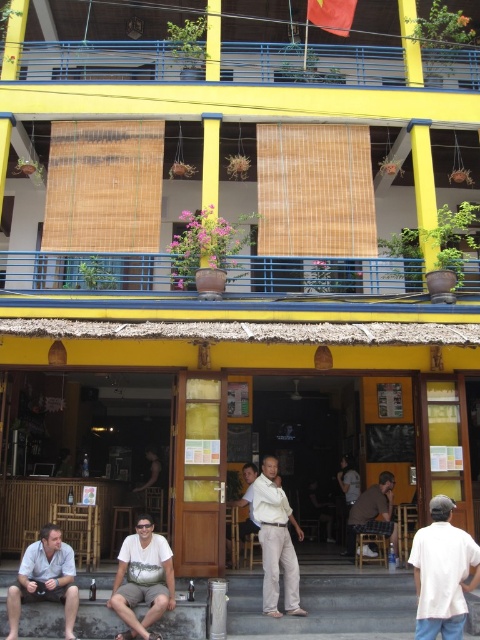
Is red fabric flag at upper center bigger than dark brown leather pants at center?

No.

Can you confirm if red fabric flag at upper center is positioned below dark brown leather pants at center?

No.

Where is `red fabric flag at upper center`? red fabric flag at upper center is located at coordinates (332, 13).

Which is below, white cotton shirt at lower center or dark brown leather pants at center?

white cotton shirt at lower center is lower down.

Can you confirm if white cotton shirt at lower center is positioned to the left of dark brown leather pants at center?

Correct, you'll find white cotton shirt at lower center to the left of dark brown leather pants at center.

What do you see at coordinates (143, 579) in the screenshot? I see `white cotton shirt at lower center` at bounding box center [143, 579].

The image size is (480, 640). I want to click on white cotton shirt at lower center, so click(x=143, y=579).

Between white matte shirt at center and brown fabric shirt at lower center, which one has less height?

Standing shorter between the two is brown fabric shirt at lower center.

Between point (266, 486) and point (363, 528), which one is positioned behind?

Point (363, 528)

Where is `white matte shirt at center`? white matte shirt at center is located at coordinates (276, 541).